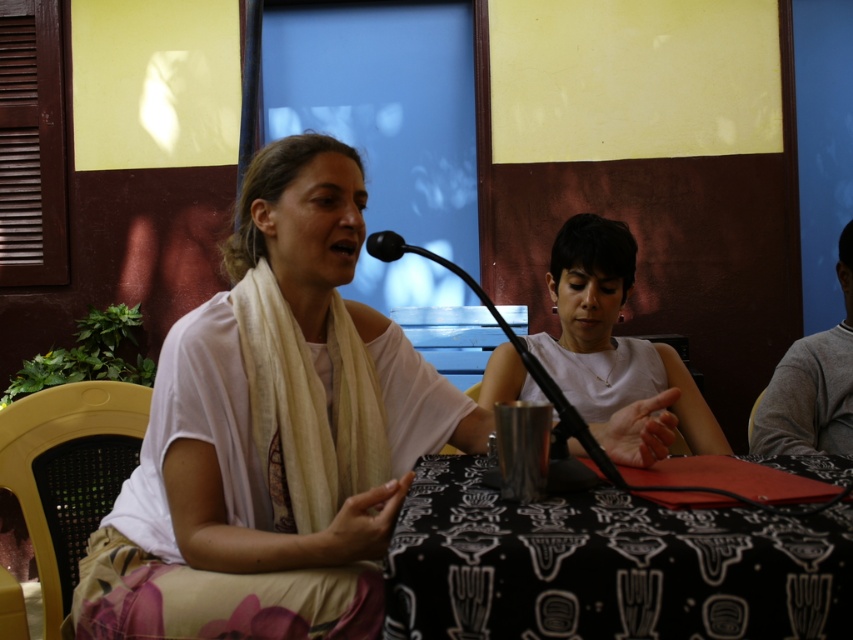
Question: Based on their relative distances, which object is nearer to the white cotton scarf at center?

Choices:
 (A) white matte shirt at center
 (B) black patterned table at center

Answer: (B)

Question: Which point appears closest to the camera in this image?

Choices:
 (A) (601, 365)
 (B) (817, 566)
 (C) (808, 360)
 (D) (285, 276)

Answer: (B)

Question: Is white cotton scarf at center further to the viewer compared to black patterned table at center?

Choices:
 (A) no
 (B) yes

Answer: (B)

Question: Is white cotton scarf at center above gray sweater at right?

Choices:
 (A) no
 (B) yes

Answer: (A)

Question: Can you confirm if black patterned table at center is bigger than gray sweater at right?

Choices:
 (A) no
 (B) yes

Answer: (A)

Question: Estimate the real-world distances between objects in this image. Which object is closer to the gray sweater at right?

Choices:
 (A) white cotton scarf at center
 (B) white matte shirt at center
 (C) black patterned table at center

Answer: (B)